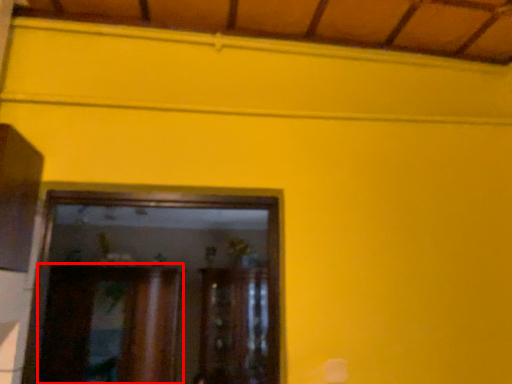
Question: From the image's perspective, where is cabinetry (annotated by the red box) located relative to cabinetry?

Choices:
 (A) below
 (B) above

Answer: (B)